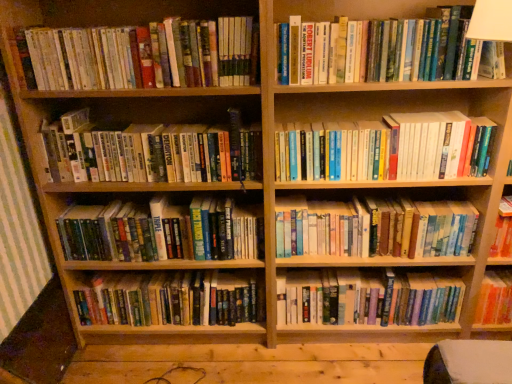
Question: From the image's perspective, is hardcover books at left, positioned as the sixth book in bottom-to-top order, on hardcover book at upper right, which is counted as the 1th book, starting from the top?

Choices:
 (A) yes
 (B) no

Answer: (B)

Question: Considering the relative sizes of hardcover books at left, positioned as the sixth book in bottom-to-top order, and hardcover book at upper right, which is counted as the 1th book, starting from the top, in the image provided, is hardcover books at left, positioned as the sixth book in bottom-to-top order, thinner than hardcover book at upper right, which is counted as the 1th book, starting from the top,?

Choices:
 (A) no
 (B) yes

Answer: (A)

Question: Is hardcover books at left, positioned as the sixth book in bottom-to-top order, closer to the viewer compared to hardcover book at upper right, the 8th book when ordered from bottom to top?

Choices:
 (A) no
 (B) yes

Answer: (A)

Question: Is hardcover books at left, positioned as the sixth book in bottom-to-top order, positioned beyond the bounds of hardcover book at upper right, the 8th book when ordered from bottom to top?

Choices:
 (A) yes
 (B) no

Answer: (A)

Question: Is hardcover books at left, positioned as the sixth book in bottom-to-top order, at the right side of hardcover book at upper right, the 8th book when ordered from bottom to top?

Choices:
 (A) yes
 (B) no

Answer: (B)

Question: Can you confirm if hardcover books at left, positioned as the sixth book in bottom-to-top order, is taller than hardcover book at upper right, the 8th book when ordered from bottom to top?

Choices:
 (A) no
 (B) yes

Answer: (B)

Question: From the image's perspective, is hardcover book at upper right, which is counted as the 1th book, starting from the top, under hardcover books at center, arranged as the 3th book when ordered from the bottom?

Choices:
 (A) no
 (B) yes

Answer: (A)

Question: From a real-world perspective, is hardcover book at upper right, which is counted as the 1th book, starting from the top, physically below hardcover books at center, arranged as the 3th book when ordered from the bottom?

Choices:
 (A) no
 (B) yes

Answer: (A)

Question: Considering the relative positions of hardcover book at upper right, which is counted as the 1th book, starting from the top, and hardcover books at center, positioned as the 6th book in top-to-bottom order, in the image provided, is hardcover book at upper right, which is counted as the 1th book, starting from the top, to the left of hardcover books at center, positioned as the 6th book in top-to-bottom order, from the viewer's perspective?

Choices:
 (A) no
 (B) yes

Answer: (B)

Question: Is hardcover book at upper right, which is counted as the 1th book, starting from the top, positioned behind hardcover books at center, positioned as the 6th book in top-to-bottom order?

Choices:
 (A) yes
 (B) no

Answer: (B)

Question: Is hardcover book at upper right, the 8th book when ordered from bottom to top, facing towards hardcover books at center, positioned as the 6th book in top-to-bottom order?

Choices:
 (A) yes
 (B) no

Answer: (B)

Question: Can you confirm if hardcover book at upper right, the 8th book when ordered from bottom to top, is thinner than hardcover books at center, positioned as the 6th book in top-to-bottom order?

Choices:
 (A) yes
 (B) no

Answer: (A)

Question: Does hardcover book at center, positioned as the fifth book in top-to-bottom order, have a greater width compared to hardcover books at center, which appears as the 7th book when viewed from the top?

Choices:
 (A) yes
 (B) no

Answer: (B)